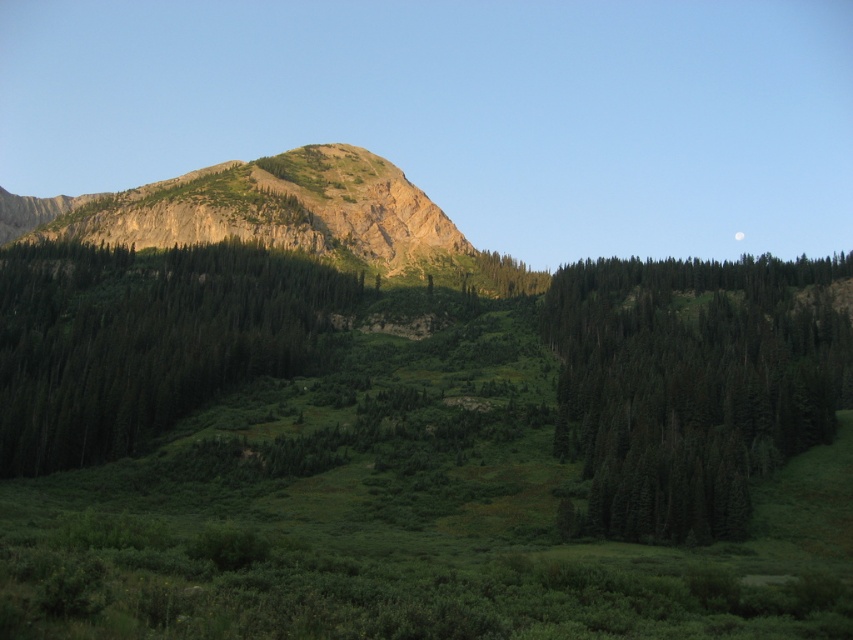
You are hiking and want to take a photo of both the green matte trees at right and the green textured trees at center. From your current position, which trees are positioned lower in the frame?

The green matte trees at right are located below the green textured trees at center, so they will appear lower in the frame.

You are standing in the mountain landscape and want to place a small flag at point A and point B. Point A is at coordinate point (44,241) and point B is at coordinate point (360,163). Which point is closer to you?

Point A at coordinate point (44,241) is closer to you because it is in front of point B at coordinate point (360,163).

You are standing at the base of the mountain and want to take a photo. There are two points in the scene marked as point 1 at coordinates (821, 440) and point 2 at coordinates (306, 193). If you want to capture both points in your photo, which point should be placed closer to the edge of the frame to ensure both are visible?

Point 1 at coordinates (821, 440) is closer to the camera than point 2 at coordinates (306, 193). To ensure both points are visible in the photo, place point 2 at coordinates (306, 193) closer to the edge of the frame since it is farther away and might be cut off if centered.